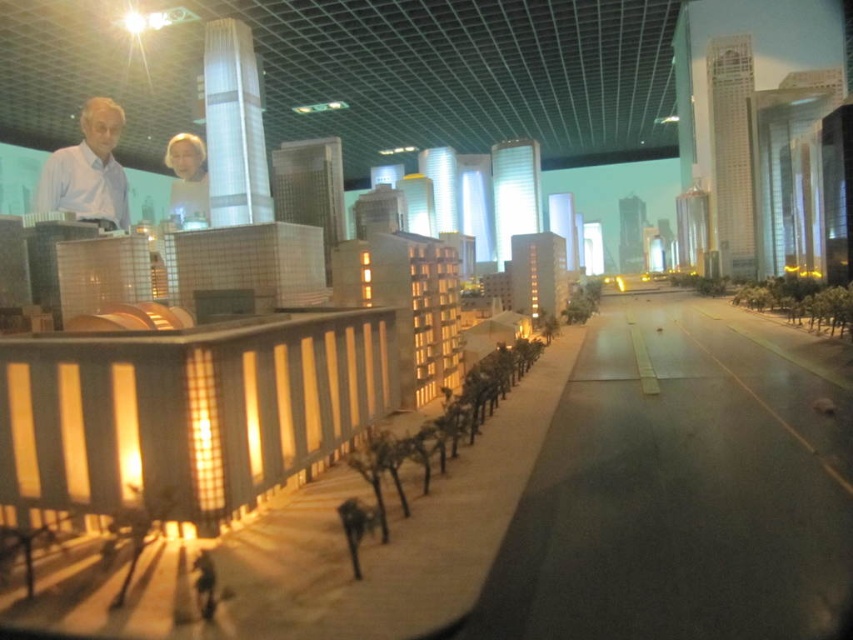
You are a visitor at an architectural exhibit and notice two figures in the model cityscape. The first is a white shirt at left, and the second is a matte white man at upper center. Based on the scene description, can you determine which of these two figures is wider?

The white shirt at left might be wider than matte white man at upper center according to the description.

You are a tour guide at an architectural exhibit and want to ensure visitors can comfortably move between the white shirt at left and the matte white man at upper center. Given that the average person requires 36 inches of space to walk comfortably, can visitors walk between these two figures without feeling cramped?

The distance between the white shirt at left and the matte white man at upper center is 38.05 inches, which is slightly more than the required 36 inches. Visitors should have enough space to walk comfortably between them.

Based on the coordinates provided, which object in the scene is located at point (88, 170)?

The white shirt at left is located at point (88, 170).